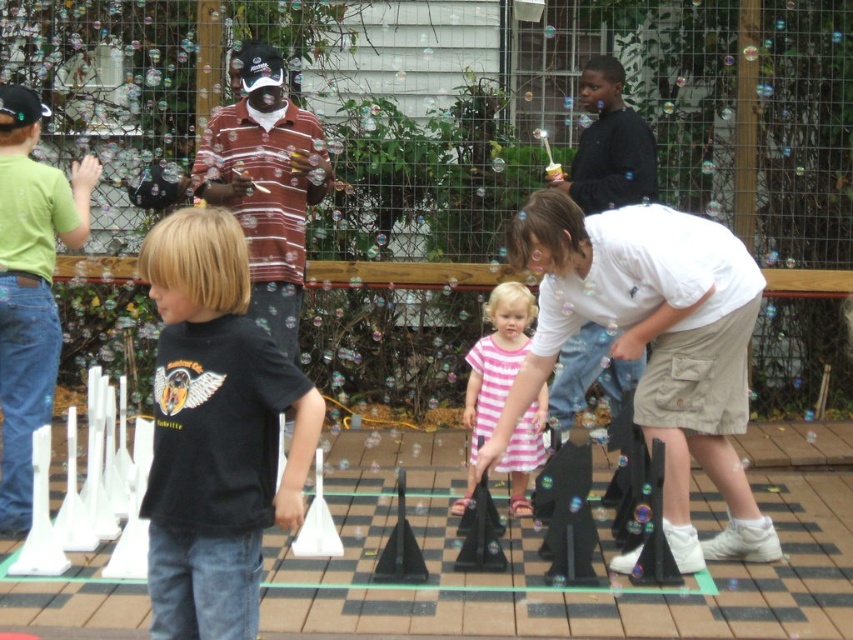
You are a photographer trying to capture a group photo of the black matte shirt at center and the pink striped dress at center. Since you want to ensure both subjects are in focus, you need to know which one is taller. Which person should you position closer to the camera to maintain focus on both?

The black matte shirt at center is taller than the pink striped dress at center. To keep both in focus, position the black matte shirt at center closer to the camera so the depth of field can accommodate their height difference.

From the picture: You are a photographer trying to capture both the white cotton shirt at center and the black matte shirt at center in a single frame. Which shirt should you focus on first to ensure both are in the frame without moving the camera?

You should focus on the white cotton shirt at center first because it is bigger than the black matte shirt at center, so centering it will naturally include the smaller one in the frame.

You are a photographer trying to capture a shot of both the white cotton shirt at center and the pink striped dress at center. Since you want to ensure both are in focus, you need to know their vertical positions. Which one is higher up in the image?

The white cotton shirt at center is located above the pink striped dress at center, so it is higher up in the image.